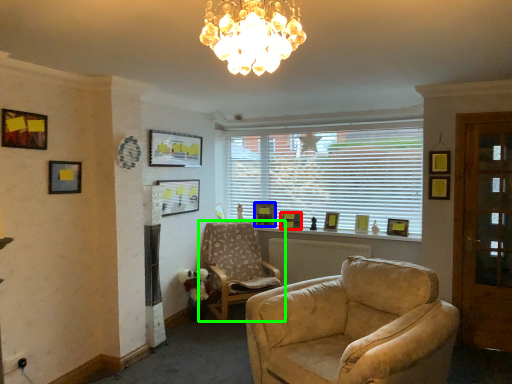
Question: Which object is positioned closest to picture frame (highlighted by a red box)? Select from picture frame (highlighted by a blue box) and chair (highlighted by a green box).

Choices:
 (A) picture frame
 (B) chair

Answer: (A)